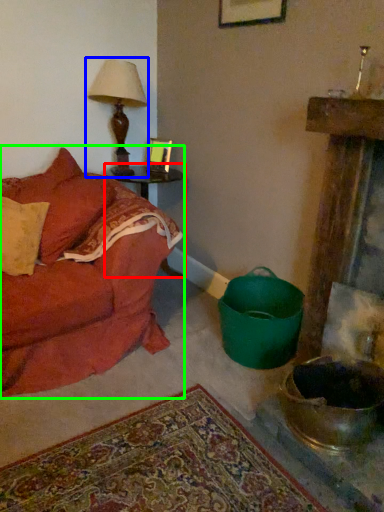
Question: Which is nearer to the table (highlighted by a red box)? table lamp (highlighted by a blue box) or studio couch (highlighted by a green box).

Choices:
 (A) table lamp
 (B) studio couch

Answer: (A)